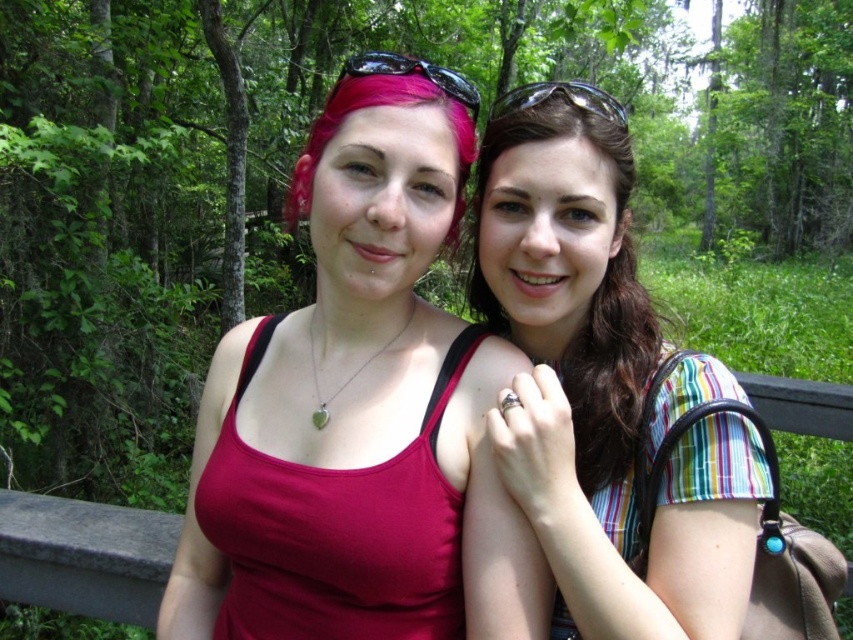
Can you confirm if matte red tank top at center is shorter than striped fabric shirt at right?

In fact, matte red tank top at center may be taller than striped fabric shirt at right.

Which is below, matte red tank top at center or striped fabric shirt at right?

matte red tank top at center is below.

Is point (354, 436) positioned behind point (712, 364)?

That is False.

The image size is (853, 640). Find the location of `matte red tank top at center`. matte red tank top at center is located at coordinates (358, 417).

Locate an element on the screen. The height and width of the screenshot is (640, 853). pink matte sunglasses at upper center is located at coordinates (413, 72).

Between pink matte sunglasses at upper center and clear plastic goggles at upper center, which one appears on the right side from the viewer's perspective?

From the viewer's perspective, clear plastic goggles at upper center appears more on the right side.

Locate an element on the screen. The height and width of the screenshot is (640, 853). pink matte sunglasses at upper center is located at coordinates (413, 72).

You are a GUI agent. You are given a task and a screenshot of the screen. Output one action in this format:
    pyautogui.click(x=<x>, y=<y>)
    Task: Click on the matte red tank top at center
    This screenshot has height=640, width=853.
    Given the screenshot: What is the action you would take?
    pyautogui.click(x=358, y=417)

In the scene shown: Does matte red tank top at center have a greater width compared to pink matte sunglasses at upper center?

Indeed, matte red tank top at center has a greater width compared to pink matte sunglasses at upper center.

Is point (178, 586) farther from viewer compared to point (457, 81)?

Yes, point (178, 586) is farther from viewer.

This screenshot has height=640, width=853. What are the coordinates of `matte red tank top at center` in the screenshot? It's located at (358, 417).